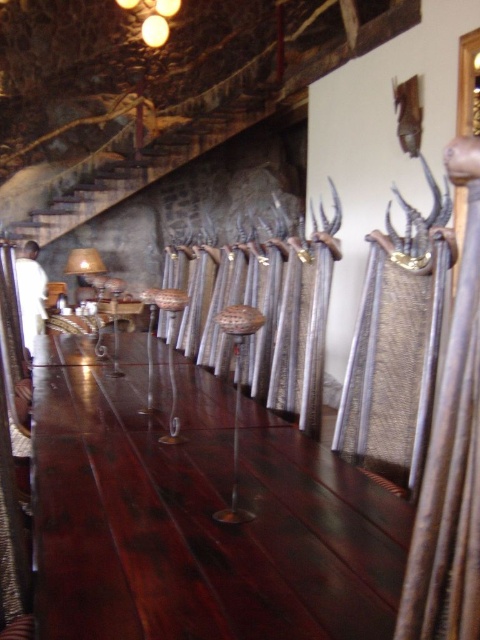
Question: Which point is closer to the camera taking this photo?

Choices:
 (A) (240, 378)
 (B) (359, 368)

Answer: (B)

Question: Can you confirm if metallic mesh sculpture at right is positioned below rustic wooden stairs at upper left?

Choices:
 (A) yes
 (B) no

Answer: (A)

Question: Is mahogany wood table at center to the right of rustic wooden stairs at upper left from the viewer's perspective?

Choices:
 (A) yes
 (B) no

Answer: (A)

Question: Which point is farther to the camera?

Choices:
 (A) (414, 419)
 (B) (117, 160)
 (C) (312, 346)
 (D) (253, 435)

Answer: (B)

Question: Among these objects, which one is farthest from the camera?

Choices:
 (A) rustic wooden stairs at upper left
 (B) mahogany wood table at center
 (C) metallic polished spears at center

Answer: (A)

Question: Is mahogany wood table at center further to the viewer compared to rustic wooden stairs at upper left?

Choices:
 (A) no
 (B) yes

Answer: (A)